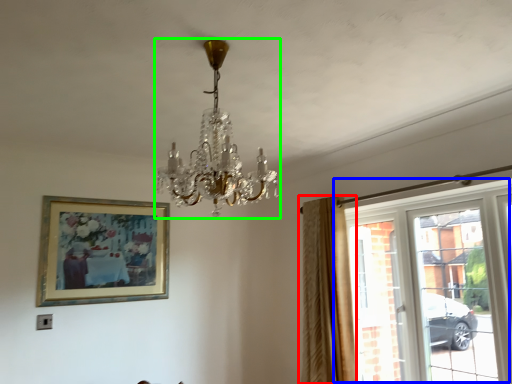
Question: Based on their relative distances, which object is farther from curtain (highlighted by a red box)? Choose from window (highlighted by a blue box) and lamp (highlighted by a green box).

Choices:
 (A) window
 (B) lamp

Answer: (B)